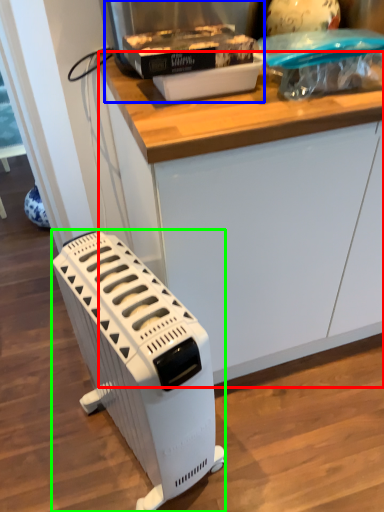
Question: Estimate the real-world distances between objects in this image. Which object is closer to counter (highlighted by a red box), appliance (highlighted by a blue box) or home appliance (highlighted by a green box)?

Choices:
 (A) appliance
 (B) home appliance

Answer: (A)